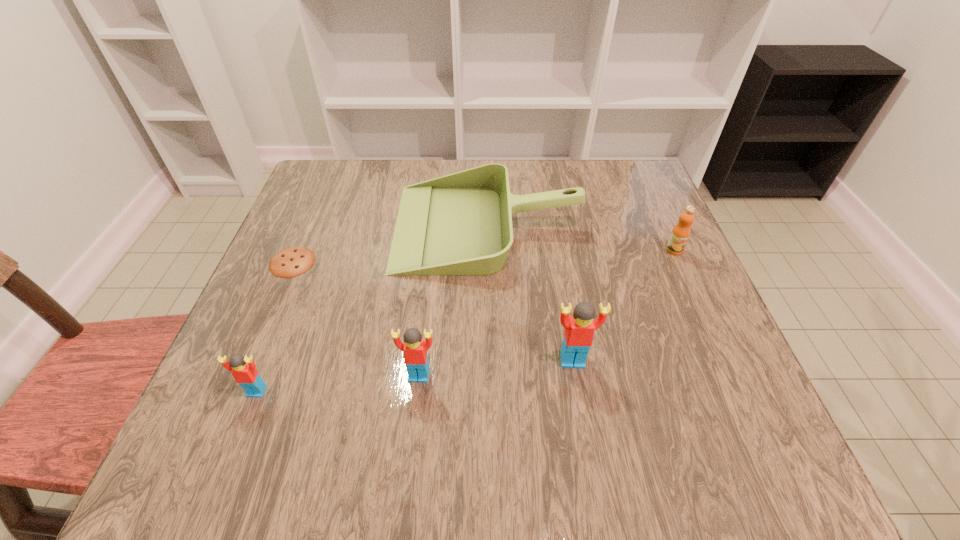
Locate an element on the screen. This screenshot has height=540, width=960. vacant point located on the scoop of the dustpan is located at coordinates (353, 226).

The image size is (960, 540). I want to click on free space located on the back of the cookie, so click(x=308, y=225).

At what (x,y) coordinates should I click in order to perform the action: click on vacant space located 0.070m on the front label of the orange juice. Please return your answer as a coordinate pair (x, y). This screenshot has height=540, width=960. Looking at the image, I should click on (686, 278).

The image size is (960, 540). Find the location of `object at the far edge`. object at the far edge is located at coordinates (460, 224).

Locate an element on the screen. Image resolution: width=960 pixels, height=540 pixels. Lego that is at the left edge is located at coordinates (244, 371).

You are a GUI agent. You are given a task and a screenshot of the screen. Output one action in this format:
    pyautogui.click(x=<x>, y=<y>)
    Task: Click on the cookie that is at the left edge
    The width and height of the screenshot is (960, 540).
    Given the screenshot: What is the action you would take?
    pyautogui.click(x=290, y=262)

Identify the location of object that is at the right edge. (680, 234).

You are a GUI agent. You are given a task and a screenshot of the screen. Output one action in this format:
    pyautogui.click(x=<x>, y=<y>)
    Task: Click on the object positioned at the near left corner
    The height and width of the screenshot is (540, 960).
    Given the screenshot: What is the action you would take?
    pyautogui.click(x=244, y=371)

Locate an element on the screen. free space at the far edge of the desktop is located at coordinates (523, 164).

The width and height of the screenshot is (960, 540). Identify the location of blank space at the near edge. (560, 390).